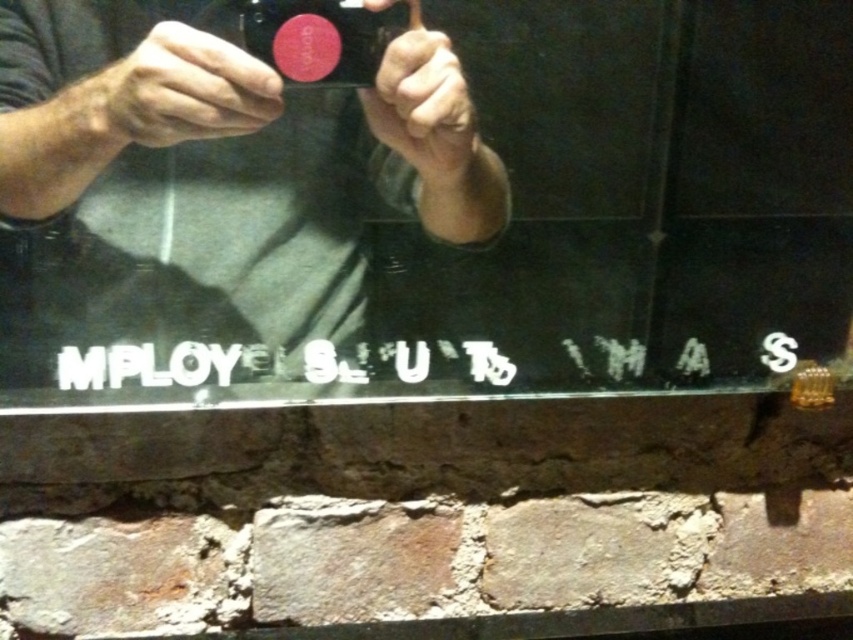
Question: In this image, where is gray matte shirt at center located relative to matte black camera at center?

Choices:
 (A) above
 (B) below

Answer: (B)

Question: Which of the following is the farthest from the observer?

Choices:
 (A) (312, 81)
 (B) (426, 83)

Answer: (B)

Question: In this image, where is gray matte shirt at center located relative to matte black camera at center?

Choices:
 (A) below
 (B) above

Answer: (A)

Question: Can you confirm if gray matte shirt at center is positioned above matte black camera at center?

Choices:
 (A) no
 (B) yes

Answer: (A)

Question: Which of the following is the farthest from the observer?

Choices:
 (A) gray matte shirt at center
 (B) matte black camera at center

Answer: (B)

Question: Which object appears farthest from the camera in this image?

Choices:
 (A) matte black camera at center
 (B) gray matte shirt at center

Answer: (A)